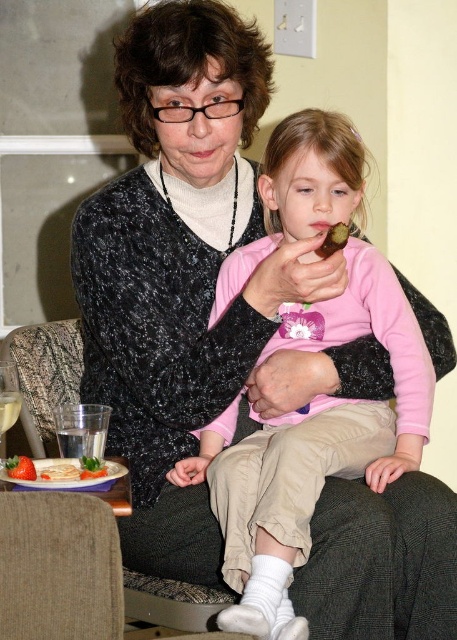
Does point (339, 241) lie behind point (69, 477)?

Yes, it is.

Looking at this image, does chocolate cake at center appear on the left side of smooth white plate at lower left?

In fact, chocolate cake at center is to the right of smooth white plate at lower left.

Image resolution: width=457 pixels, height=640 pixels. What are the coordinates of `chocolate cake at center` in the screenshot? It's located at (334, 240).

Is chocolate cake at center to the left of green leafy vegetable at lower left from the viewer's perspective?

No, chocolate cake at center is not to the left of green leafy vegetable at lower left.

Which is more to the right, chocolate cake at center or green leafy vegetable at lower left?

chocolate cake at center is more to the right.

Find the location of a particular element. chocolate cake at center is located at coordinates (334, 240).

Is the position of chocolate cake at center less distant than that of smooth red strawberry at lower left?

No, chocolate cake at center is further to the viewer.

Is chocolate cake at center shorter than smooth red strawberry at lower left?

No, chocolate cake at center is not shorter than smooth red strawberry at lower left.

Find the location of a particular element. Image resolution: width=457 pixels, height=640 pixels. chocolate cake at center is located at coordinates (334, 240).